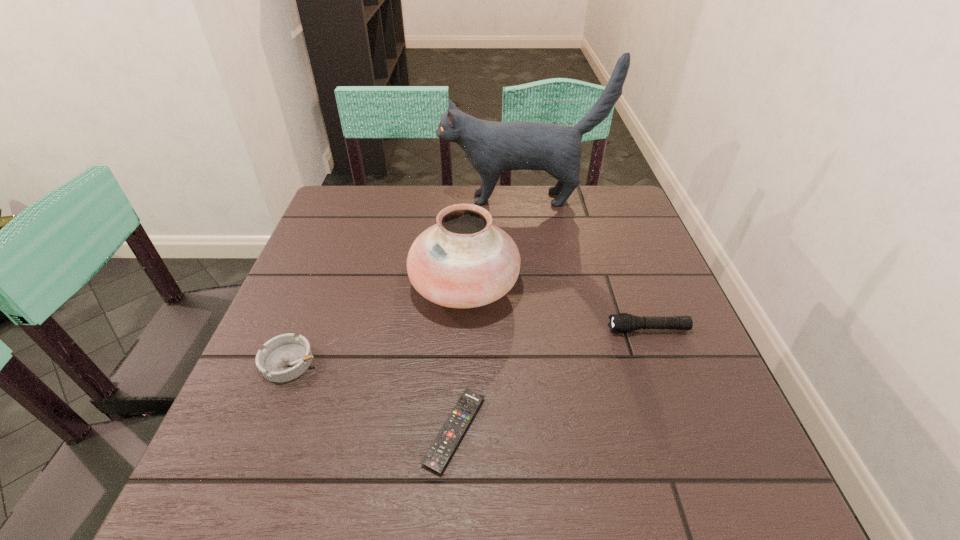
The height and width of the screenshot is (540, 960). I want to click on cat, so click(x=492, y=147).

The width and height of the screenshot is (960, 540). Identify the location of the tallest object. (492, 147).

Locate an element on the screen. This screenshot has width=960, height=540. the second tallest object is located at coordinates (464, 261).

Identify the location of flashlight. (623, 322).

Identify the location of ashtray. (285, 357).

Locate an element on the screen. The width and height of the screenshot is (960, 540). the leftmost object is located at coordinates (285, 357).

Image resolution: width=960 pixels, height=540 pixels. Find the location of `the shortest object`. the shortest object is located at coordinates (440, 451).

The image size is (960, 540). I want to click on remote control, so click(440, 451).

Locate an element on the screen. This screenshot has height=540, width=960. vacant space located 0.220m at the face of the tallest object is located at coordinates (366, 199).

Image resolution: width=960 pixels, height=540 pixels. What are the coordinates of `vacant space located 0.120m at the face of the tallest object` in the screenshot? It's located at (399, 199).